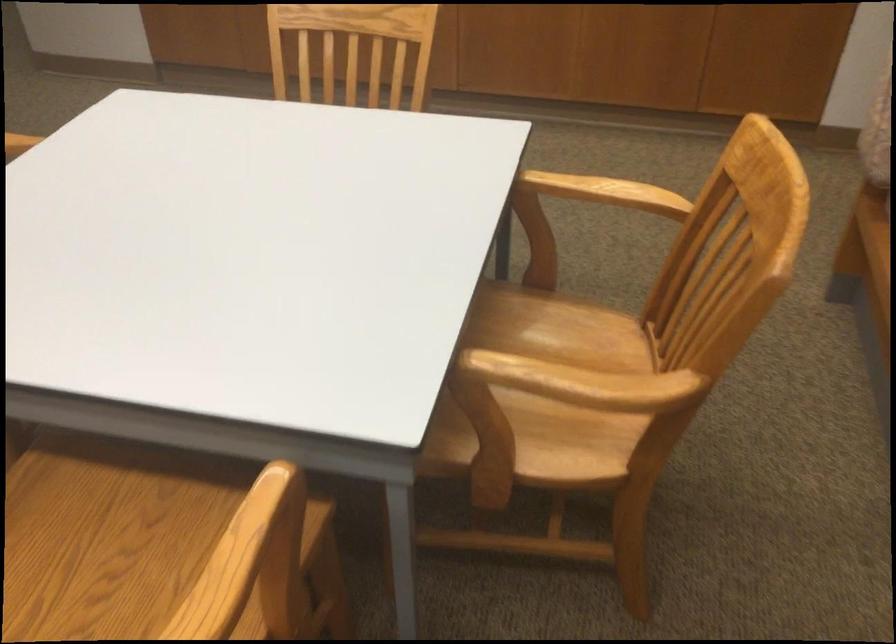
What do you see at coordinates (567, 330) in the screenshot?
I see `a chair sitting surface` at bounding box center [567, 330].